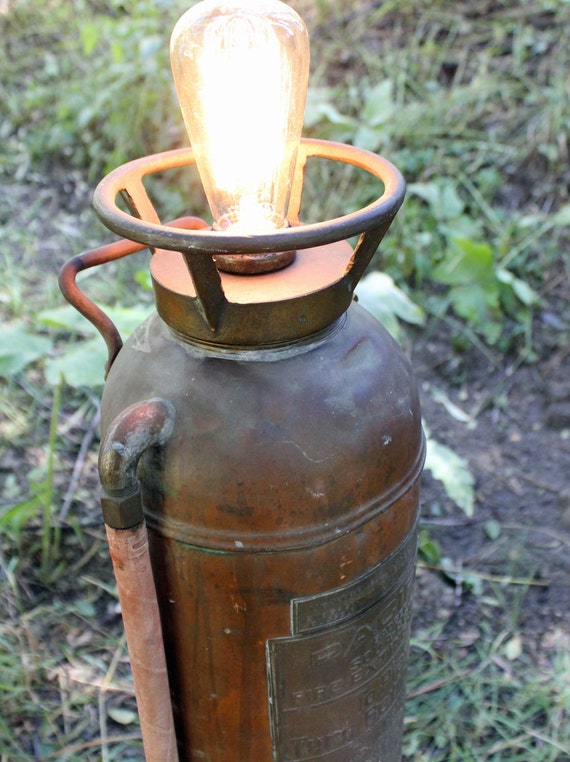
Image resolution: width=570 pixels, height=762 pixels. I want to click on light bulb, so click(254, 143).